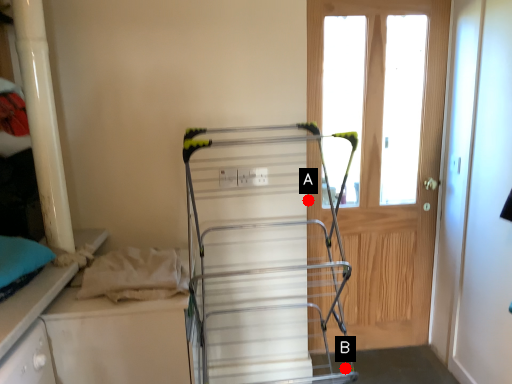
Question: Two points are circled on the image, labeled by A and B beside each circle. Which point is closer to the camera taking this photo?

Choices:
 (A) A is closer
 (B) B is closer

Answer: (B)